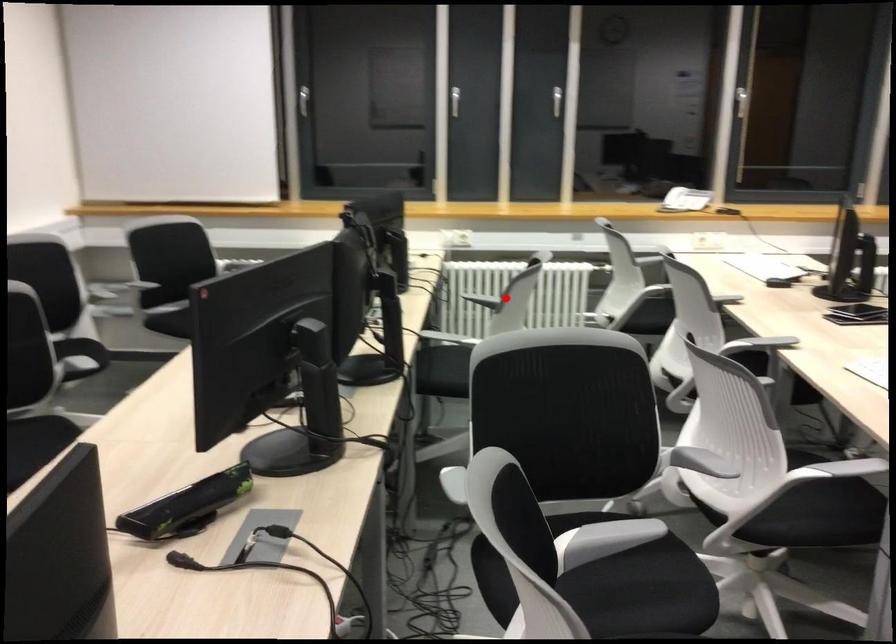
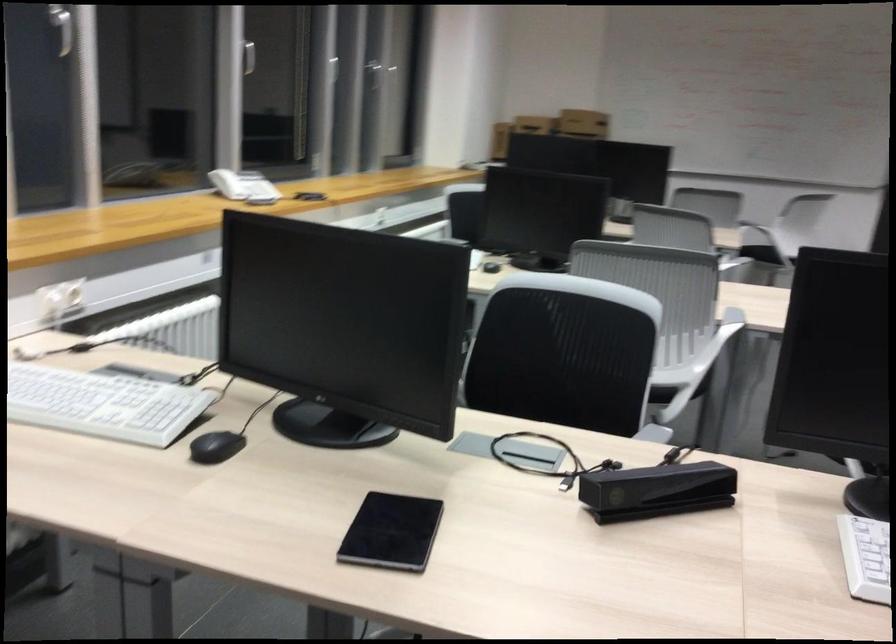
Question: I am providing you with two images of the same scene from different viewpoints. A red point is shown in image1. For the corresponding object point in image2, is it positioned nearer or farther from the camera?

Choices:
 (A) Nearer
 (B) Farther

Answer: (A)